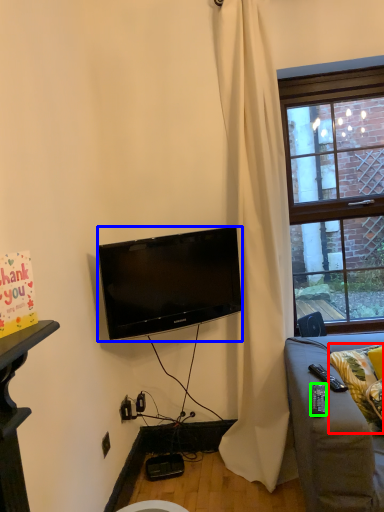
Question: Which is farther away from pillow (highlighted by a red box)? television (highlighted by a blue box) or remote control (highlighted by a green box)?

Choices:
 (A) television
 (B) remote control

Answer: (A)